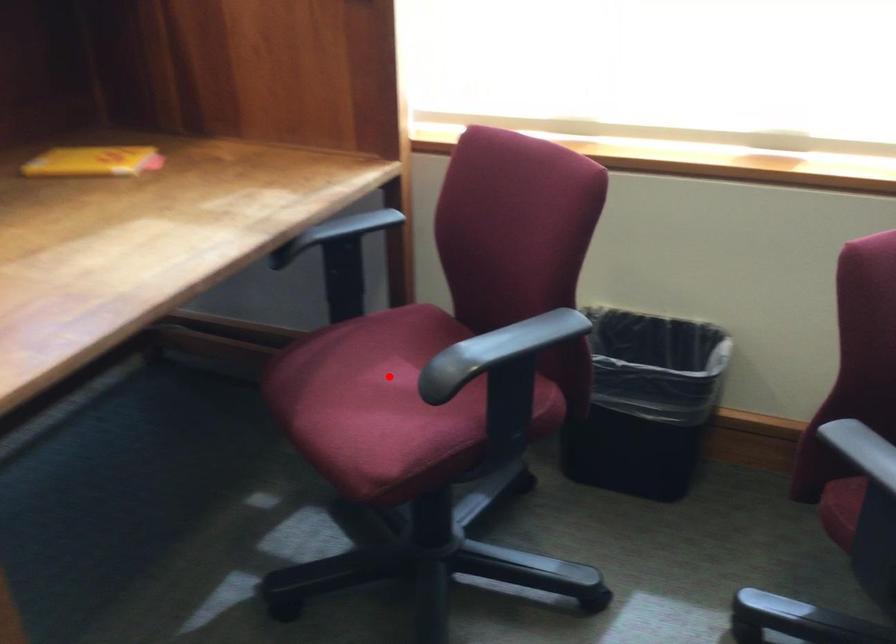
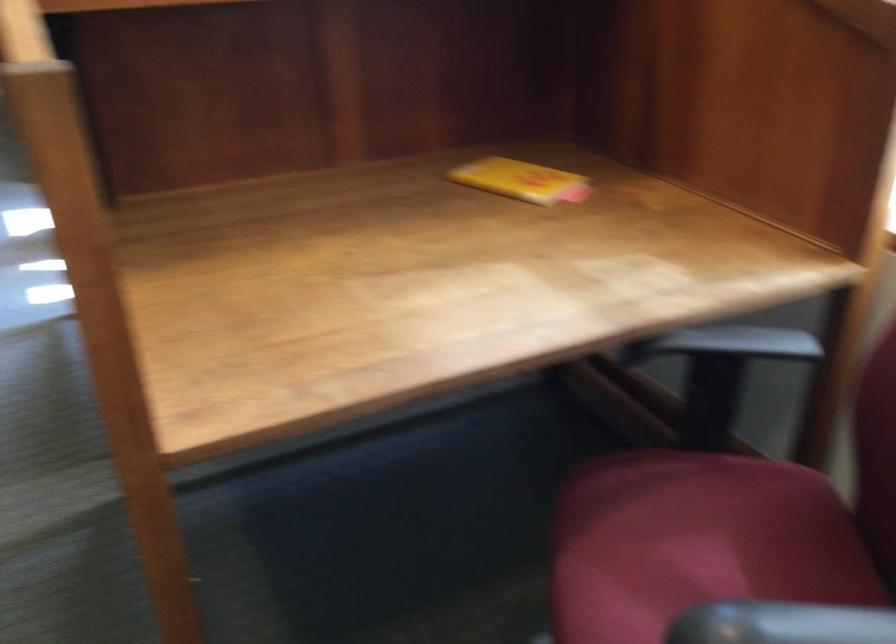
Find the pixel in the second image that matches the highlighted location in the first image.

(694, 554)